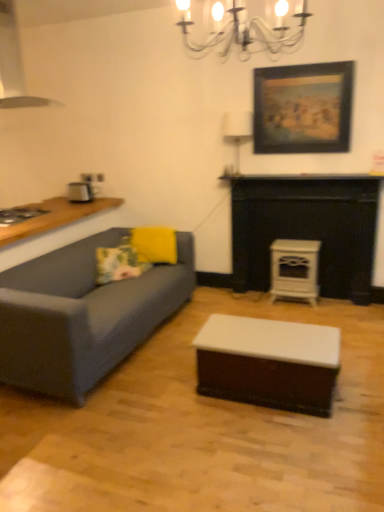
Question: Considering the positions of white glossy coffee table at center and floral fabric pillow at left, which is counted as the 2th pillow, starting from the right, in the image, is white glossy coffee table at center bigger or smaller than floral fabric pillow at left, which is counted as the 2th pillow, starting from the right,?

Choices:
 (A) small
 (B) big

Answer: (B)

Question: From a real-world perspective, is white glossy coffee table at center physically located above or below floral fabric pillow at left, the 1th pillow in the left-to-right sequence?

Choices:
 (A) below
 (B) above

Answer: (A)

Question: Estimate the real-world distances between objects in this image. Which object is closer to the yellow matte pillow at center, the second pillow viewed from the left?

Choices:
 (A) white fabric lampshade at upper center
 (B) white glossy counter top at upper center
 (C) white glossy coffee table at center
 (D) floral fabric pillow at left, which is counted as the 2th pillow, starting from the right
 (E) white glossy stove at center-right, the second appliance from the back

Answer: (D)

Question: Estimate the real-world distances between objects in this image. Which object is farther from the metallic silver exhaust hood at upper left?

Choices:
 (A) yellow matte pillow at center, acting as the 1th pillow starting from the right
 (B) white glossy coffee table at center
 (C) white glossy counter top at upper center
 (D) wooden framed painting at upper right
 (E) white glossy stove at center-right, acting as the second appliance starting from the left

Answer: (B)